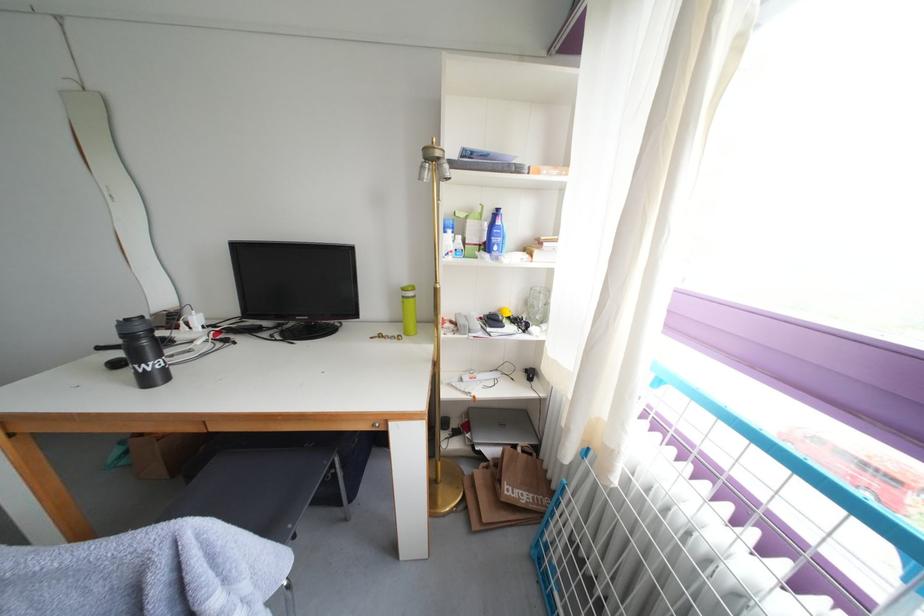
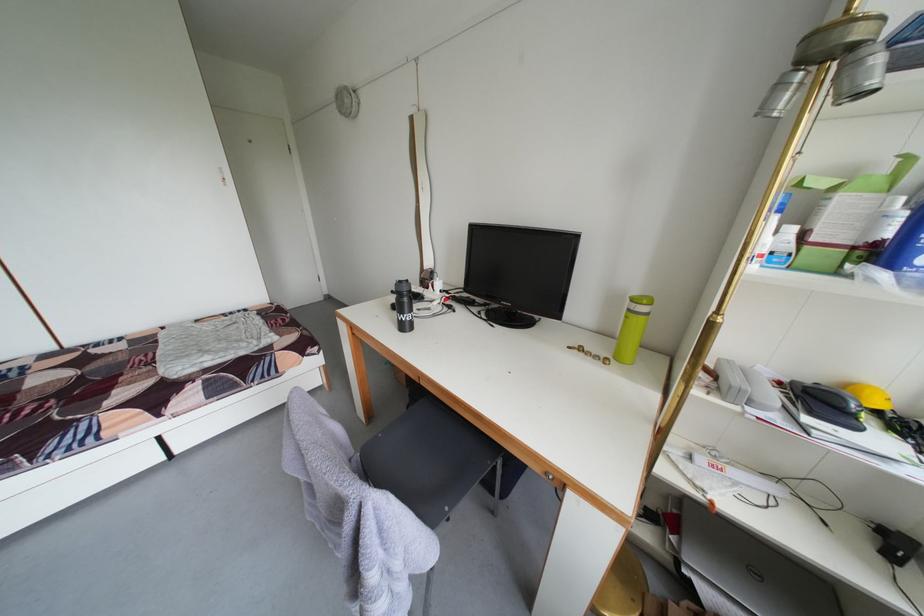
Question: The camera is either moving clockwise (left) or counter-clockwise (right) around the object. The first image is from the beginning of the video and the second image is from the end. Is the camera moving left or right when shooting the video?

Choices:
 (A) Left
 (B) Right

Answer: (B)